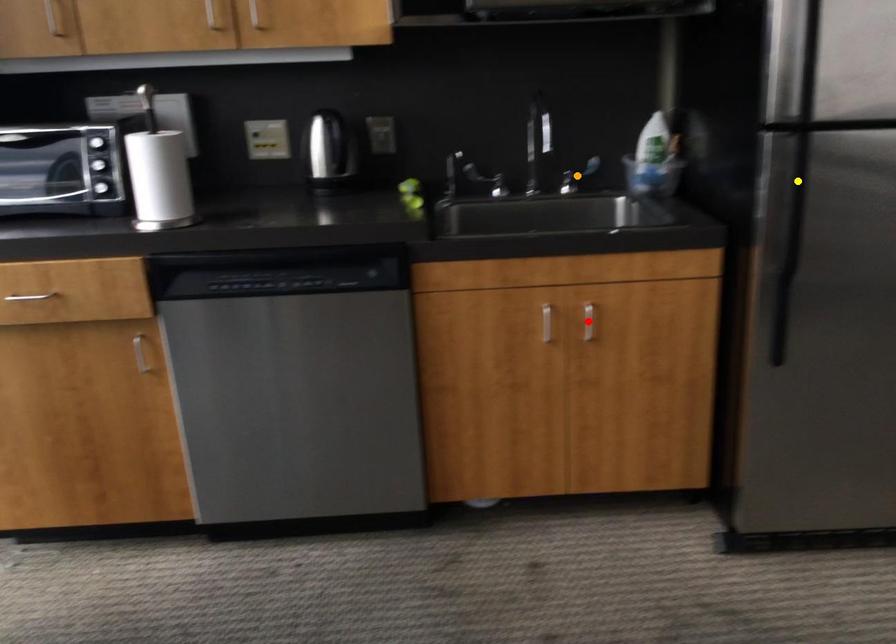
Order these from farthest to nearest:
yellow point, red point, orange point

orange point → red point → yellow point